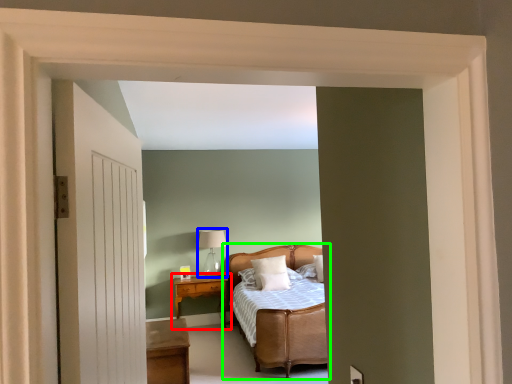
Question: Estimate the real-world distances between objects in this image. Which object is farther from nightstand (highlighted by a red box), table lamp (highlighted by a blue box) or bed (highlighted by a green box)?

Choices:
 (A) table lamp
 (B) bed

Answer: (B)